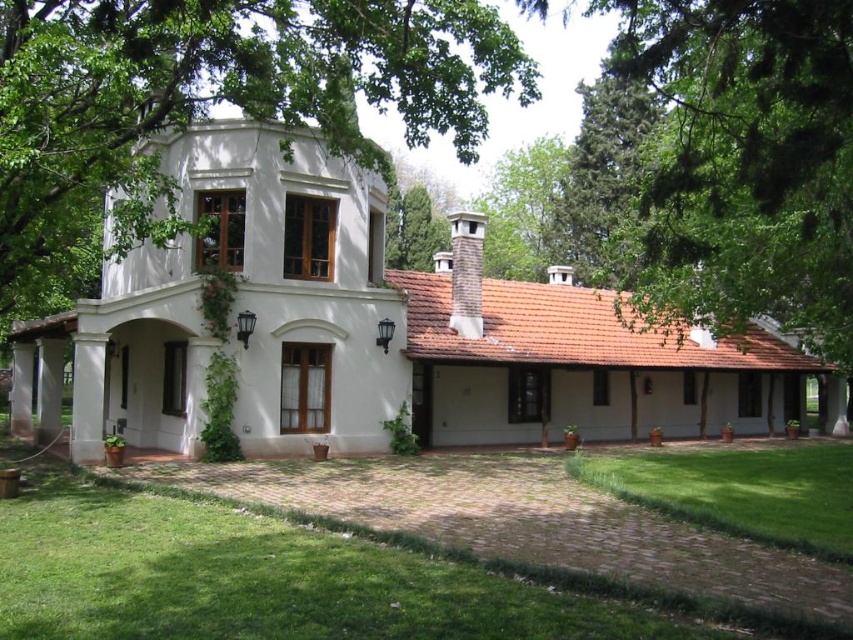
Looking at this image, you are standing at the entrance of the house and looking towards the green leafy tree at upper center and the green grass lawn at lower right. Which object is closer to you?

The green leafy tree at upper center is closer to you because it is in front of the green grass lawn at lower right.

You are standing in front of the house and want to know which object is taller between the green leafy tree at upper center and the green grass lawn at lower right. Can you determine this?

The green leafy tree at upper center has a greater height compared to the green grass lawn at lower right, so the green leafy tree at upper center is taller.

You are standing in front of the house and notice two points marked on the image. One is at coordinate point (105, 6) and the other at point (851, 472). Which point is closer to your current position?

Point (105, 6) is closer to the camera than point (851, 472), so the point at (105, 6) is closer to your current position.